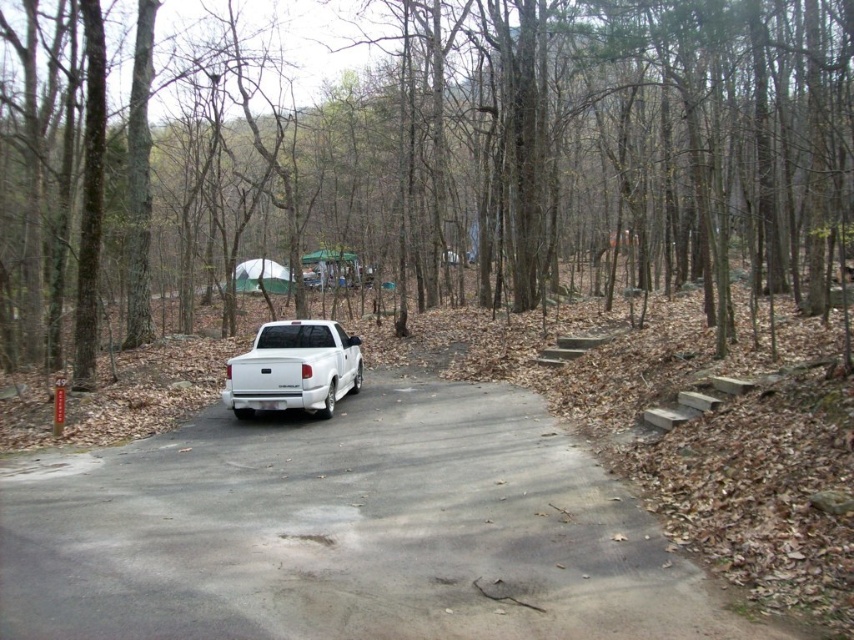
Question: From the image, what is the correct spatial relationship of brown rough tree at center in relation to white asphalt road at center?

Choices:
 (A) left
 (B) right

Answer: (B)

Question: Is brown rough tree at center positioned before white glossy truck at center?

Choices:
 (A) yes
 (B) no

Answer: (A)

Question: Does white asphalt road at center lie behind white glossy truck at center?

Choices:
 (A) yes
 (B) no

Answer: (B)

Question: Which of the following is the closest to the observer?

Choices:
 (A) white glossy truck at center
 (B) white asphalt road at center

Answer: (B)

Question: Which object is farther from the camera taking this photo?

Choices:
 (A) brown rough tree at center
 (B) white asphalt road at center
 (C) white glossy truck at center

Answer: (C)

Question: Among these objects, which one is nearest to the camera?

Choices:
 (A) white asphalt road at center
 (B) white glossy truck at center
 (C) brown rough tree at center

Answer: (A)